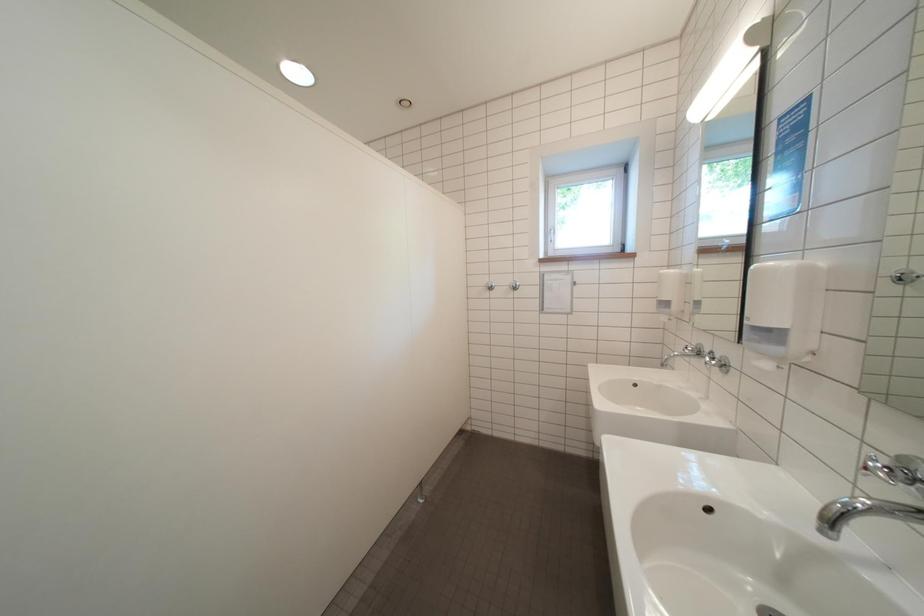
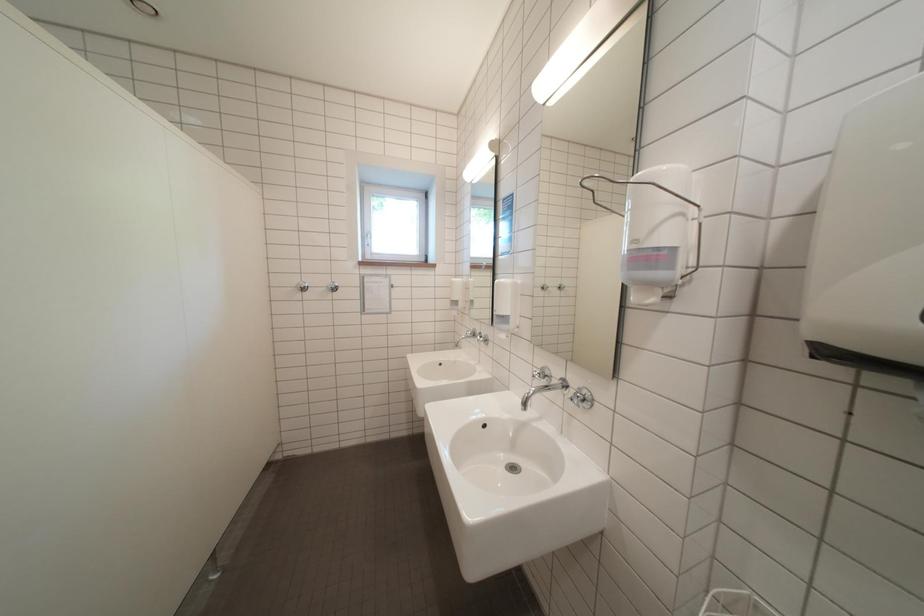
Question: The camera is either moving clockwise (left) or counter-clockwise (right) around the object. The first image is from the beginning of the video and the second image is from the end. Is the camera moving left or right when shooting the video?

Choices:
 (A) Left
 (B) Right

Answer: (A)